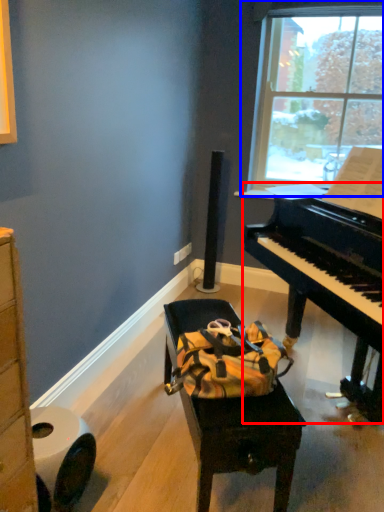
Question: Among these objects, which one is farthest to the camera, piano (highlighted by a red box) or window (highlighted by a blue box)?

Choices:
 (A) piano
 (B) window

Answer: (B)